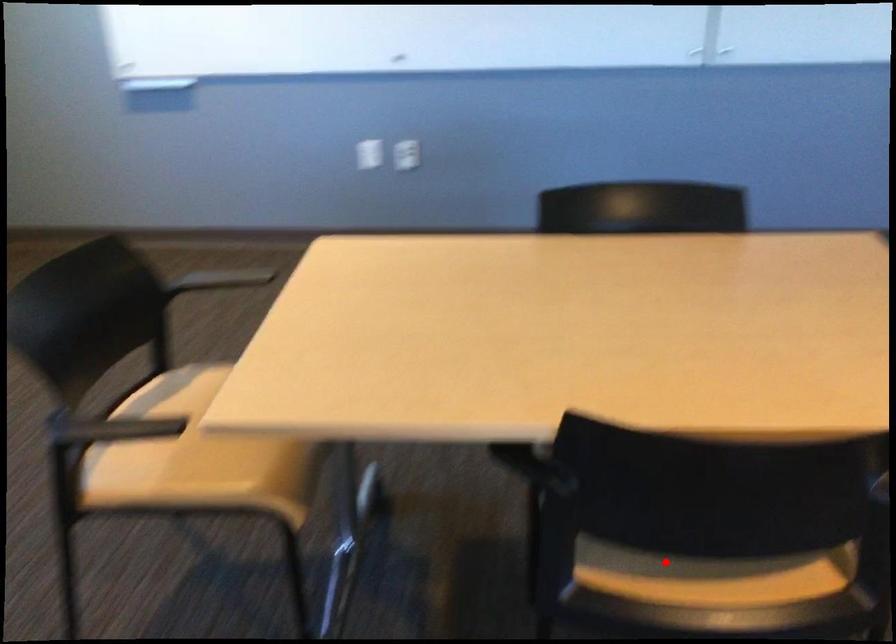
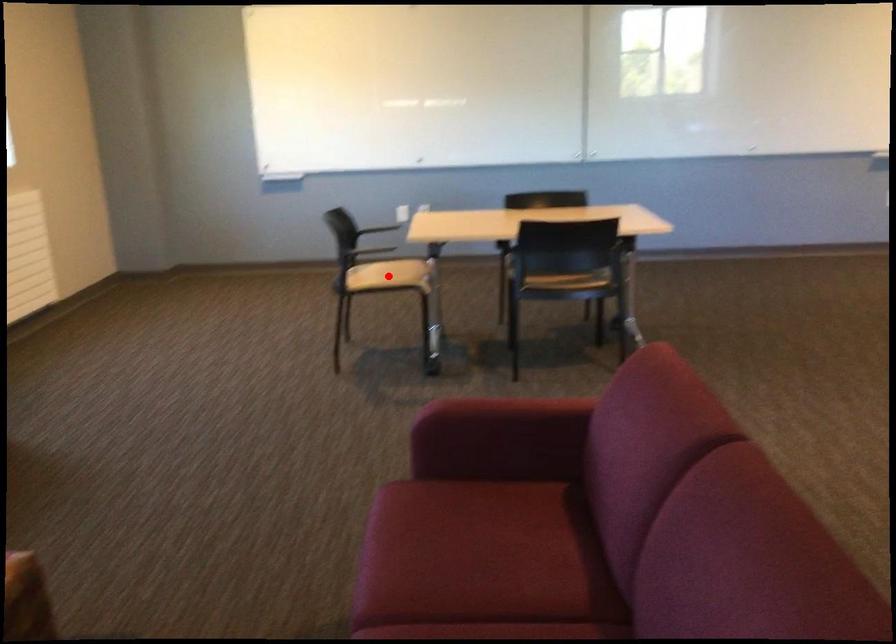
I am providing you with two images of the same scene from different viewpoints. A red point is marked on the first image and another point is marked on the second image. Are the points marked in image1 and image2 representing the same 3D position?

No